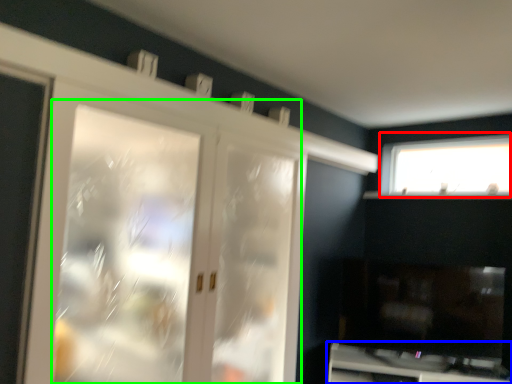
Question: Which is farther away from window (highlighted by a red box)? cabinetry (highlighted by a blue box) or screen door (highlighted by a green box)?

Choices:
 (A) cabinetry
 (B) screen door

Answer: (B)